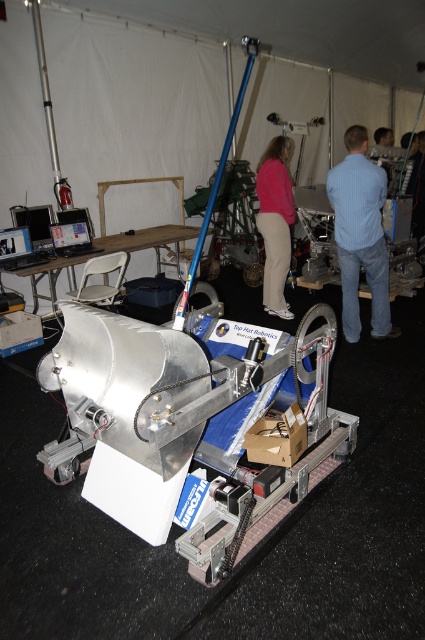
Does point (354, 228) come closer to viewer compared to point (272, 289)?

Yes, point (354, 228) is closer to viewer.

Which is more to the left, blue shirt at center or matte pink sweater at center?

matte pink sweater at center is more to the left.

Between point (384, 189) and point (272, 244), which one is positioned in front?

Point (384, 189) is in front.

This screenshot has width=425, height=640. I want to click on blue shirt at center, so click(360, 234).